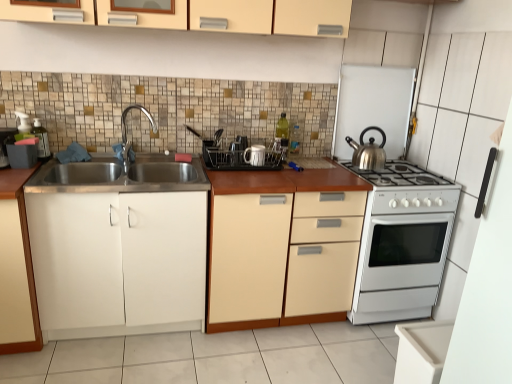
Find the location of a particular element. vacant area that is in front of clear plastic utensil rack at center, which ranks as the 2th appliance in left-to-right order is located at coordinates (239, 177).